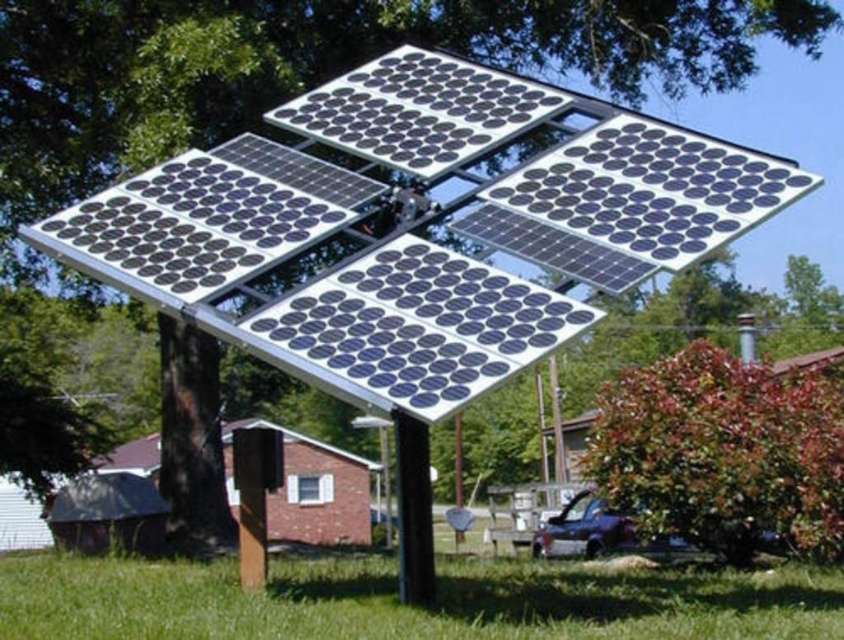
Between silver/black solar panel at center and brown shingles at lower center, which one is positioned higher?

silver/black solar panel at center is higher up.

Does silver/black solar panel at center appear on the right side of brown shingles at lower center?

Indeed, silver/black solar panel at center is positioned on the right side of brown shingles at lower center.

You are a GUI agent. You are given a task and a screenshot of the screen. Output one action in this format:
    pyautogui.click(x=<x>, y=<y>)
    Task: Click on the silver/black solar panel at center
    The image size is (844, 640).
    Given the screenshot: What is the action you would take?
    414,328

At what (x,y) coordinates should I click in order to perform the action: click on silver/black solar panel at center. Please return your answer as a coordinate pair (x, y). The height and width of the screenshot is (640, 844). Looking at the image, I should click on (414, 328).

Is point (388, 310) positioned after point (350, 97)?

No, (388, 310) is in front of (350, 97).

Does silver/black solar panel at center appear on the left side of black matte solar panel at upper center?

Incorrect, silver/black solar panel at center is not on the left side of black matte solar panel at upper center.

Locate an element on the screen. silver/black solar panel at center is located at coordinates (414, 328).

Is silver/black solar panel at center closer to the viewer compared to black metallic pole at center?

That is True.

Locate an element on the screen. This screenshot has height=640, width=844. silver/black solar panel at center is located at coordinates (414, 328).

Which is in front, point (311, 371) or point (431, 557)?

Point (311, 371)

Find the location of a particular element. The width and height of the screenshot is (844, 640). silver/black solar panel at center is located at coordinates (414, 328).